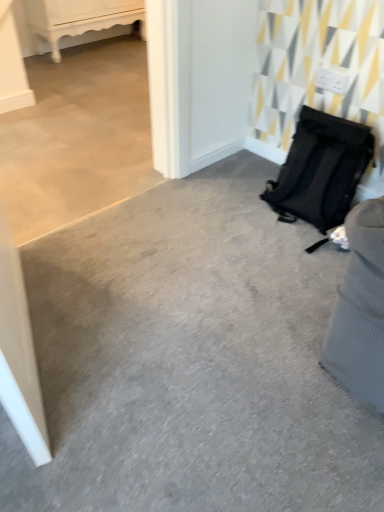
Question: In terms of size, does black fabric backpack at right appear bigger or smaller than white glossy cabinet at upper left?

Choices:
 (A) small
 (B) big

Answer: (B)

Question: From a real-world perspective, relative to white glossy cabinet at upper left, is black fabric backpack at right vertically above or below?

Choices:
 (A) above
 (B) below

Answer: (B)

Question: Which is farther from the black fabric backpack at right?

Choices:
 (A) white glossy cabinet at upper left
 (B) matte black backpack at right

Answer: (A)

Question: Based on their relative distances, which object is farther from the matte black backpack at right?

Choices:
 (A) black fabric backpack at right
 (B) white glossy cabinet at upper left

Answer: (B)